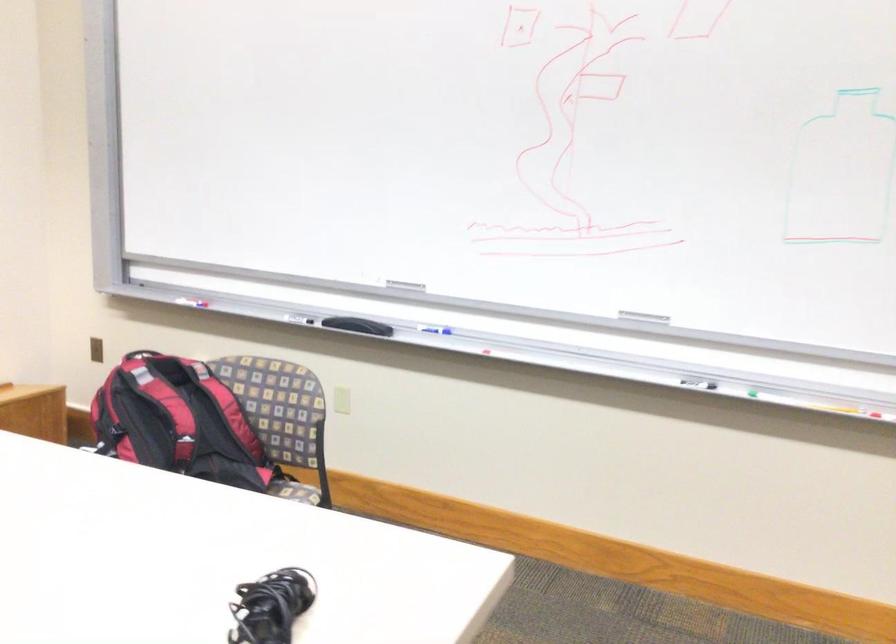
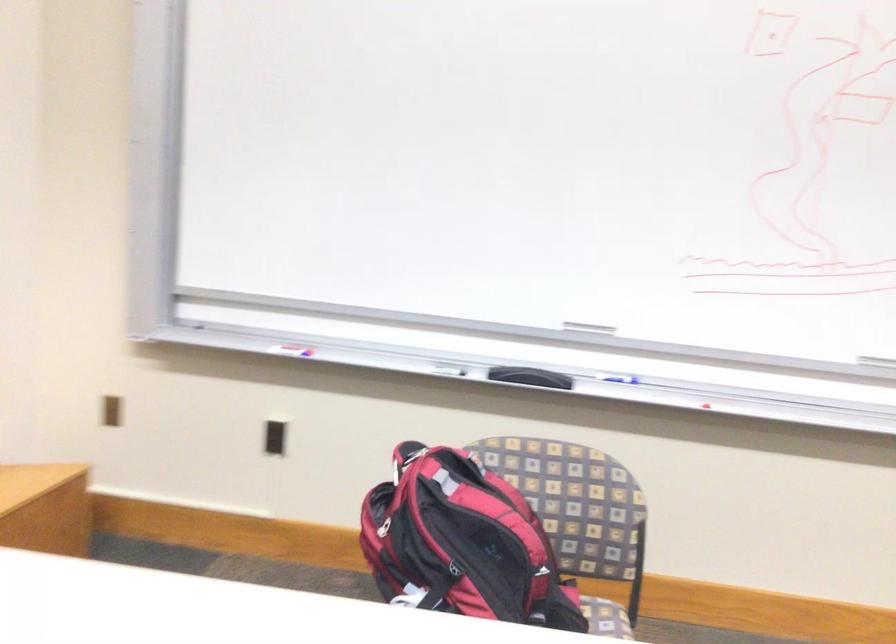
Locate, in the second image, the point that corresponds to (x=73, y=342) in the first image.

(112, 410)